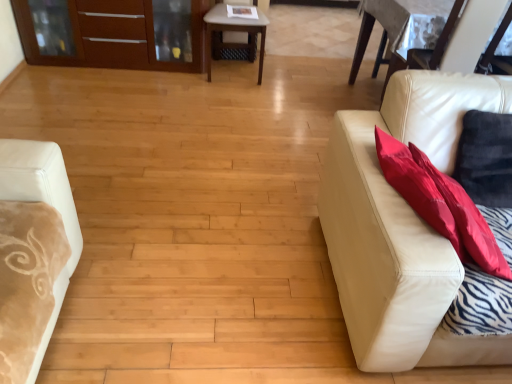
Looking at this image, what is the approximate width of leather couch at right?

leather couch at right is 37.81 inches wide.

What is the approximate height of matte wood dresser at upper left?

matte wood dresser at upper left is 22.01 inches tall.

In order to face red fabric pillow at right, should I rotate leftwards or rightwards?

A 23.516 degree turn to the right will do.

You are a GUI agent. You are given a task and a screenshot of the screen. Output one action in this format:
    pyautogui.click(x=<x>, y=<y>)
    Task: Click on the leather couch at right
    The image size is (512, 384).
    Given the screenshot: What is the action you would take?
    pyautogui.click(x=402, y=226)

Which object is closer to the camera, matte wood dresser at upper left or leather couch at right?

Positioned in front is leather couch at right.

Can you confirm if matte wood dresser at upper left is positioned to the right of leather couch at right?

In fact, matte wood dresser at upper left is to the left of leather couch at right.

In the scene shown: From a real-world perspective, is matte wood dresser at upper left positioned above or below leather couch at right?

matte wood dresser at upper left is situated lower than leather couch at right in the real world.

In terms of height, does matte wood dresser at upper left look taller or shorter compared to leather couch at right?

Considering their sizes, matte wood dresser at upper left has less height than leather couch at right.

How different are the orientations of light brown wooden table at center and red fabric pillow at right in degrees?

There is a 5.08-degree angle between the facing directions of light brown wooden table at center and red fabric pillow at right.

From the picture: Would you say light brown wooden table at center is outside red fabric pillow at right?

light brown wooden table at center lies outside red fabric pillow at right's area.

Does point (262, 45) come farther from viewer compared to point (439, 221)?

Yes, point (262, 45) is farther from viewer.

Is light brown wooden table at center thinner than red fabric pillow at right?

Incorrect, the width of light brown wooden table at center is not less than that of red fabric pillow at right.

From a real-world perspective, between leather couch at right and matte wood dresser at upper left, who is vertically lower?

matte wood dresser at upper left, from a real-world perspective.

This screenshot has width=512, height=384. What are the coordinates of `studio couch below the matte wood dresser at upper left (from the image's perspective)` in the screenshot? It's located at (402, 226).

Can we say leather couch at right lies outside matte wood dresser at upper left?

Indeed, leather couch at right is completely outside matte wood dresser at upper left.

In the image, is leather couch at right on the left side or the right side of matte wood dresser at upper left?

Based on their positions, leather couch at right is located to the right of matte wood dresser at upper left.

From the image's perspective, is leather couch at right positioned above or below red fabric pillow at right?

Clearly, from the image's perspective, leather couch at right is below red fabric pillow at right.

Is leather couch at right looking in the opposite direction of red fabric pillow at right?

That's not correct — leather couch at right is not looking away from red fabric pillow at right.

Is point (396, 104) farther from camera compared to point (494, 262)?

Yes.

Looking at this image, considering the relative sizes of leather couch at right and red fabric pillow at right in the image provided, is leather couch at right wider than red fabric pillow at right?

Yes.

Consider the image. Is light brown wooden table at center turned away from leather couch at right?

light brown wooden table at center does not have its back to leather couch at right.

Is leather couch at right located within light brown wooden table at center?

No, leather couch at right is not a part of light brown wooden table at center.

How distant is light brown wooden table at center from leather couch at right?

A distance of 6.20 feet exists between light brown wooden table at center and leather couch at right.

Is light brown wooden table at center taller than leather couch at right?

No, light brown wooden table at center is not taller than leather couch at right.

Which is in front, matte wood dresser at upper left or red fabric pillow at right?

Positioned in front is red fabric pillow at right.

From the image's perspective, between matte wood dresser at upper left and red fabric pillow at right, who is located below?

red fabric pillow at right.

Is matte wood dresser at upper left taller or shorter than red fabric pillow at right?

Clearly, matte wood dresser at upper left is taller compared to red fabric pillow at right.

Considering the sizes of objects red fabric pillow at right and light brown wooden table at center in the image provided, who is shorter, red fabric pillow at right or light brown wooden table at center?

red fabric pillow at right.

Which of these two, red fabric pillow at right or light brown wooden table at center, is wider?

With larger width is light brown wooden table at center.

From the image's perspective, which one is positioned higher, red fabric pillow at right or light brown wooden table at center?

light brown wooden table at center is shown above in the image.

From a real-world perspective, who is located higher, red fabric pillow at right or light brown wooden table at center?

red fabric pillow at right is physically above.

This screenshot has height=384, width=512. Identify the location of studio couch below the matte wood dresser at upper left (from the image's perspective). (402, 226).

Find the location of a particular element. The width and height of the screenshot is (512, 384). throw pillow located in front of the light brown wooden table at center is located at coordinates (440, 203).

From the image, which object appears to be nearer to leather couch at right, matte wood dresser at upper left or red fabric pillow at right?

Among the two, red fabric pillow at right is located nearer to leather couch at right.

Based on the photo, which object lies nearer to the anchor point leather couch at right, red fabric pillow at right or light brown wooden table at center?

red fabric pillow at right lies closer to leather couch at right than the other object.

From the image, which object appears to be nearer to matte wood dresser at upper left, red fabric pillow at right or light brown wooden table at center?

light brown wooden table at center is positioned closer to the anchor matte wood dresser at upper left.

Which object lies further to the anchor point red fabric pillow at right, matte wood dresser at upper left or leather couch at right?

Among the two, matte wood dresser at upper left is located further to red fabric pillow at right.

Considering their positions, is light brown wooden table at center positioned further to leather couch at right than red fabric pillow at right?

light brown wooden table at center.

Estimate the real-world distances between objects in this image. Which object is further from matte wood dresser at upper left, leather couch at right or light brown wooden table at center?

Among the two, leather couch at right is located further to matte wood dresser at upper left.

From the image, which object appears to be nearer to matte wood dresser at upper left, red fabric pillow at right or leather couch at right?

Based on the image, leather couch at right appears to be nearer to matte wood dresser at upper left.

From the image, which object appears to be nearer to leather couch at right, matte wood dresser at upper left or light brown wooden table at center?

Based on the image, light brown wooden table at center appears to be nearer to leather couch at right.

Find the location of a particular element. throw pillow positioned between leather couch at right and light brown wooden table at center from near to far is located at coordinates (440, 203).

Find the location of `table positioned between red fabric pillow at right and matte wood dresser at upper left from near to far`. table positioned between red fabric pillow at right and matte wood dresser at upper left from near to far is located at coordinates (233, 30).

This screenshot has width=512, height=384. In order to click on table between leather couch at right and matte wood dresser at upper left from front to back in this screenshot , I will do `click(233, 30)`.

Identify the location of throw pillow positioned between leather couch at right and matte wood dresser at upper left from near to far. (440, 203).